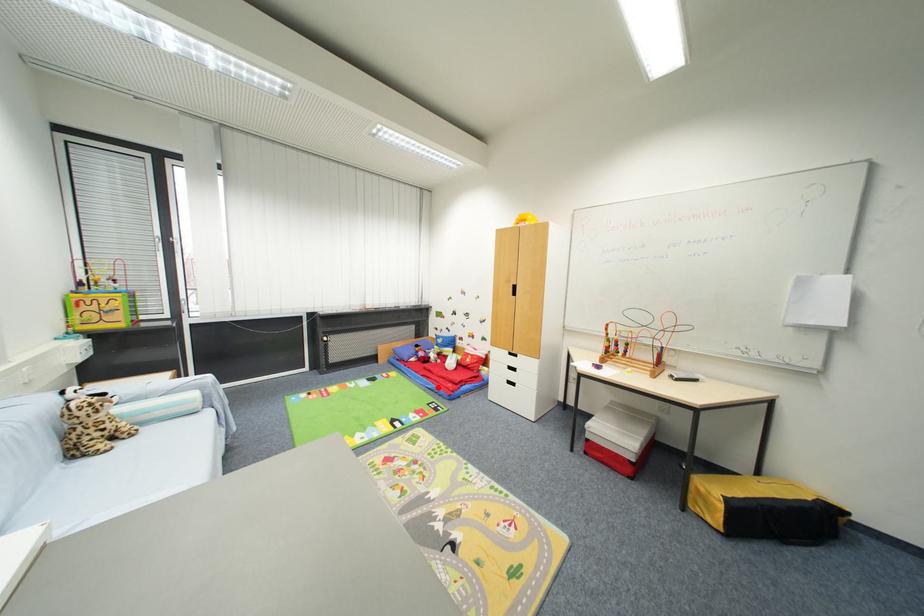
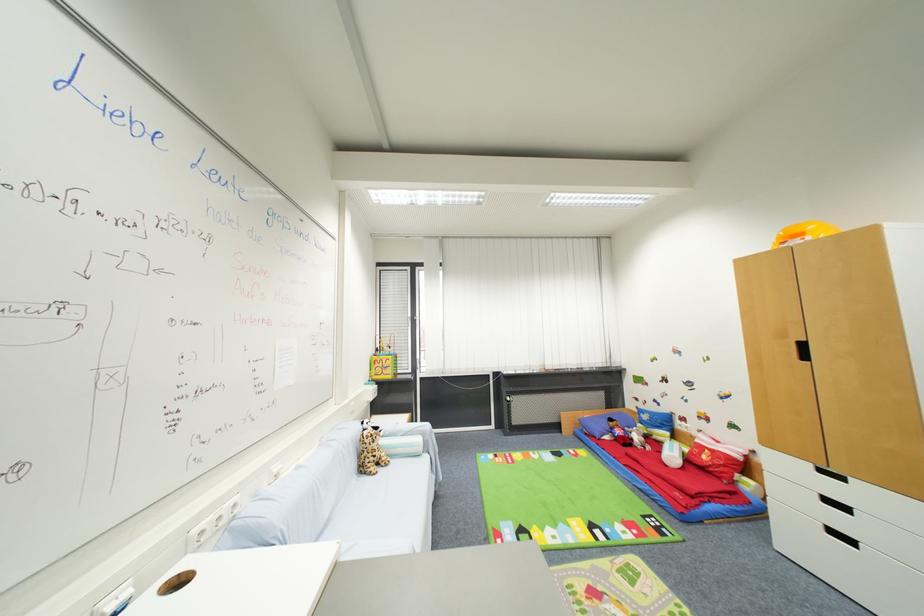
Question: I am providing you with two images of the same scene from different viewpoints. Image1 has a red point marked. In image2, the corresponding 3D location appears at what relative position? Reply with the corresponding letter.

Choices:
 (A) Closer
 (B) Farther

Answer: (A)